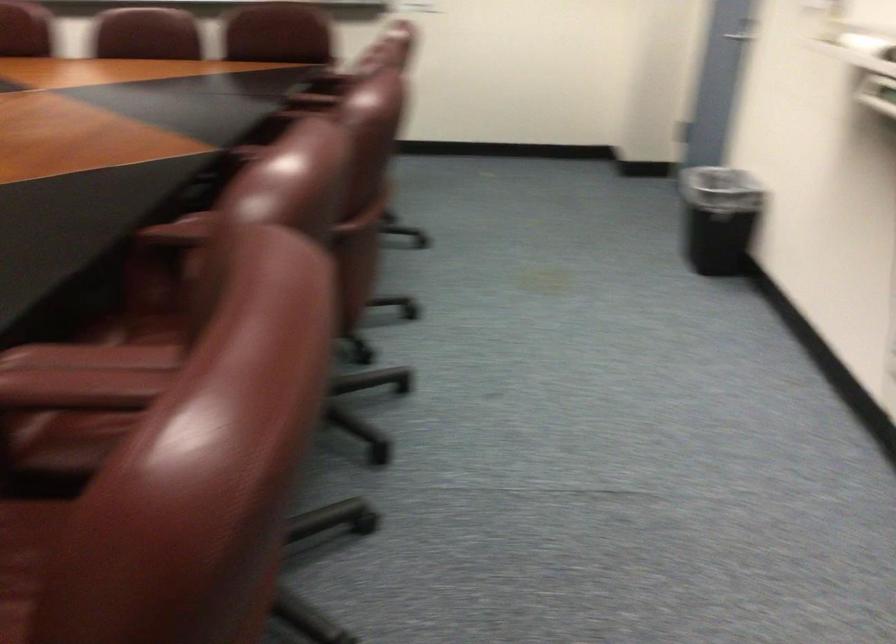
Where would you lift the black trash can? Please return your answer as a coordinate pair (x, y).

(719, 218)